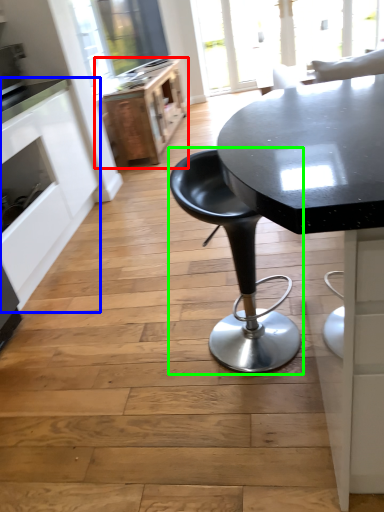
Question: Which object is positioned closest to file cabinet (highlighted by a red box)? Select from cabinetry (highlighted by a blue box) and chair (highlighted by a green box).

Choices:
 (A) cabinetry
 (B) chair

Answer: (A)